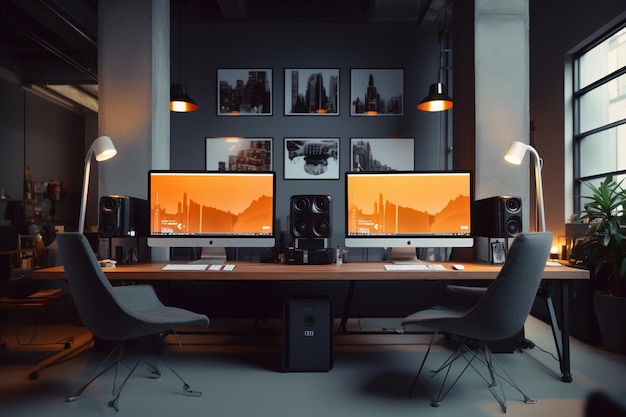
You are a GUI agent. You are given a task and a screenshot of the screen. Output one action in this format:
    pyautogui.click(x=<x>, y=<y>)
    Task: Click on the chairs
    Image resolution: width=626 pixels, height=417 pixels.
    Given the screenshot: What is the action you would take?
    pyautogui.click(x=473, y=314), pyautogui.click(x=125, y=309)